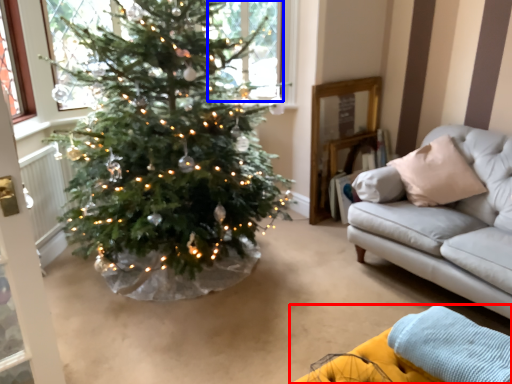
Question: Which point is further to the camera, couch (highlighted by a red box) or window (highlighted by a blue box)?

Choices:
 (A) couch
 (B) window

Answer: (B)